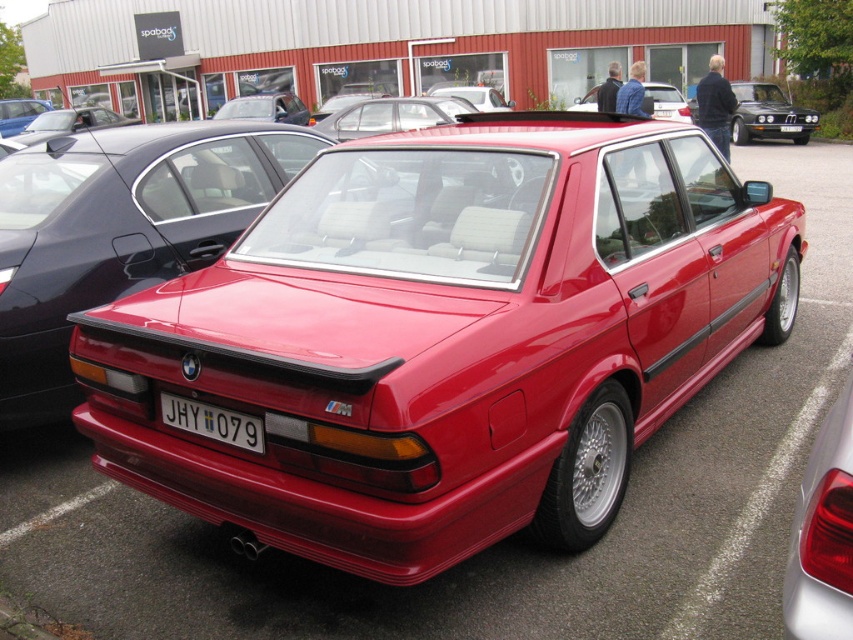
Which is more to the right, glossy white taillight at lower right or white plastic license plate at center?

glossy white taillight at lower right

Is point (788, 554) positioned after point (207, 422)?

No, (788, 554) is in front of (207, 422).

Identify the location of glossy white taillight at lower right. (822, 534).

Can you confirm if glossy black sedan at upper right is smaller than glossy red sedan at center?

Yes, glossy black sedan at upper right is smaller than glossy red sedan at center.

Between glossy black sedan at upper right and glossy red sedan at center, which one is positioned higher?

glossy red sedan at center

Locate an element on the screen. The width and height of the screenshot is (853, 640). glossy black sedan at upper right is located at coordinates (769, 115).

Is point (682, 102) closer to viewer compared to point (0, 108)?

Yes, point (682, 102) is in front of point (0, 108).

Which is above, glossy red sedan at center or glossy metallic car at upper left?

glossy metallic car at upper left is higher up.

Is point (653, 83) more distant than point (24, 106)?

No, (653, 83) is closer to viewer.

Where is `glossy red sedan at center`? The image size is (853, 640). glossy red sedan at center is located at coordinates pyautogui.click(x=666, y=100).